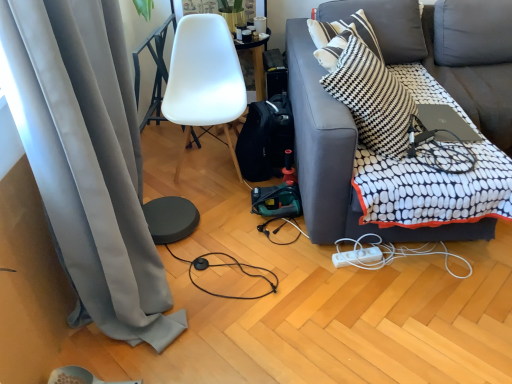
Where is `free area in between white plastic power outlet at lower center and gray fabric curtain at left`? The height and width of the screenshot is (384, 512). free area in between white plastic power outlet at lower center and gray fabric curtain at left is located at coordinates (265, 310).